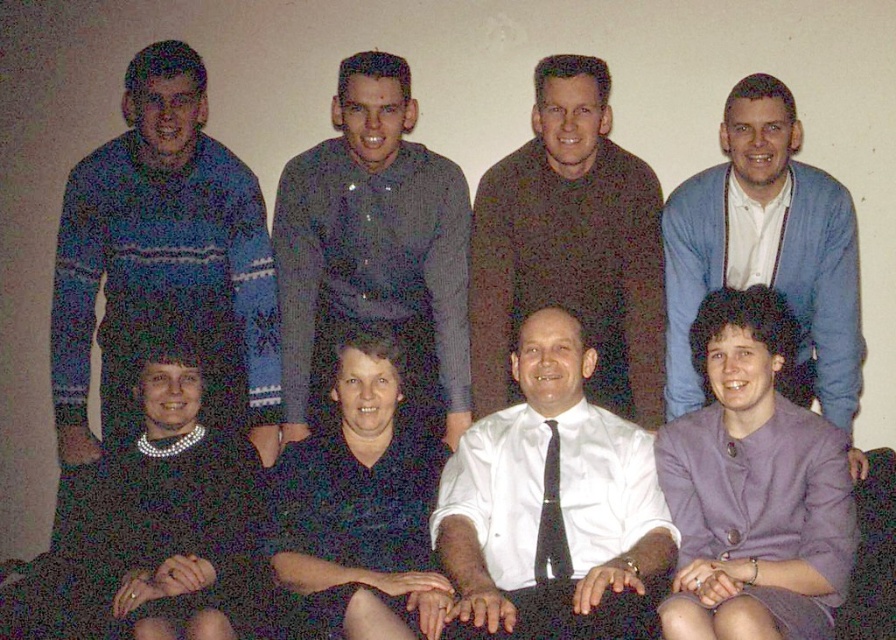
Question: Which point appears closest to the camera in this image?

Choices:
 (A) (399, 138)
 (B) (673, 541)
 (C) (690, 198)

Answer: (B)

Question: Can you confirm if white satin shirt at center is positioned above blue cardigan at upper right?

Choices:
 (A) yes
 (B) no

Answer: (B)

Question: Which point appears farthest from the camera in this image?

Choices:
 (A) (450, 196)
 (B) (564, 576)
 (C) (722, 268)
 (D) (162, 140)

Answer: (A)

Question: Among these objects, which one is farthest from the camera?

Choices:
 (A) black silk tie at center
 (B) dark brown sweater at upper center

Answer: (B)

Question: Can you confirm if dark gray textured shirt at center is thinner than blue cardigan at upper right?

Choices:
 (A) yes
 (B) no

Answer: (B)

Question: Where is blue cardigan at upper right located in relation to dark blue shirt at center in the image?

Choices:
 (A) right
 (B) left

Answer: (A)